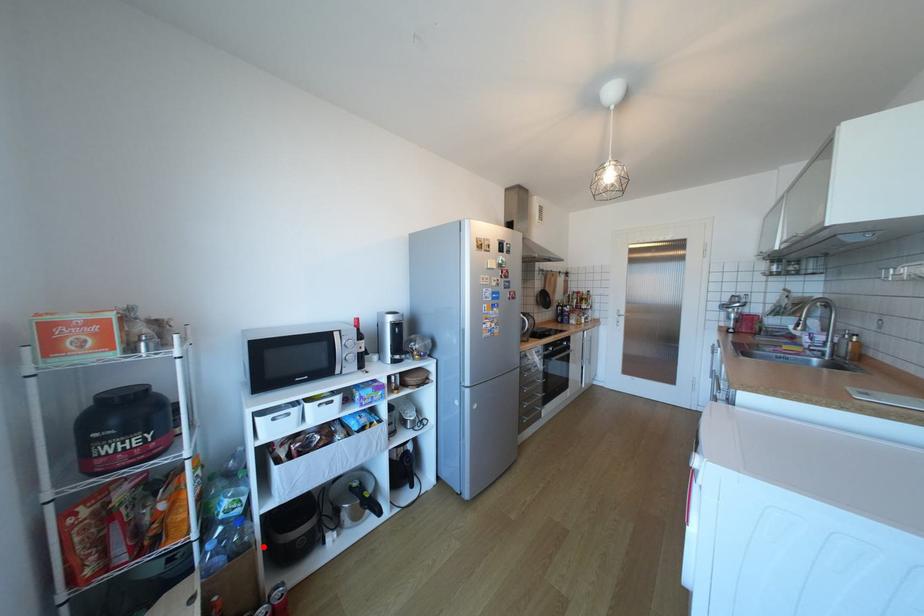
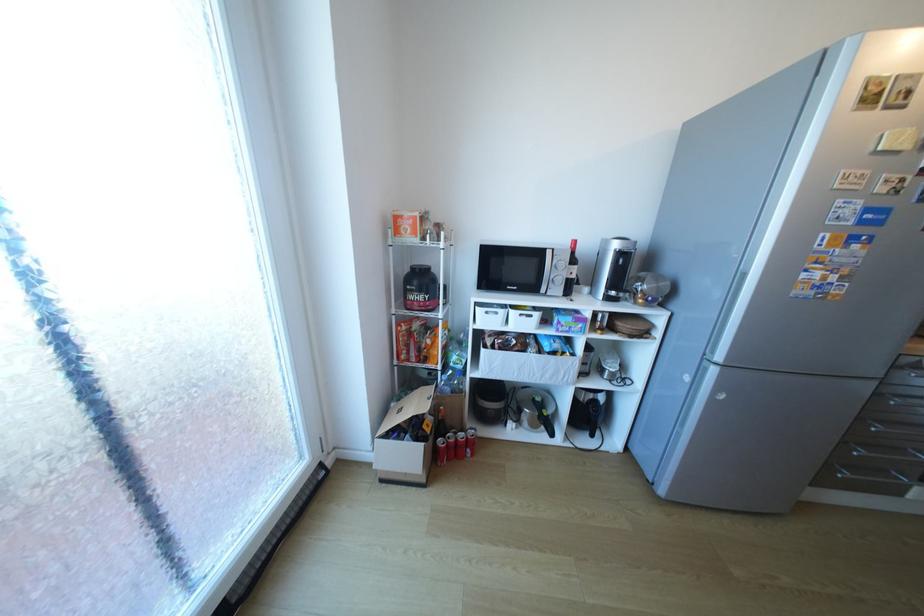
Question: I am providing you with two images of the same scene from different viewpoints. In image1, a red point is highlighted. Considering the same 3D point in image2, which of the following is correct?

Choices:
 (A) It is closer
 (B) It is farther

Answer: (B)